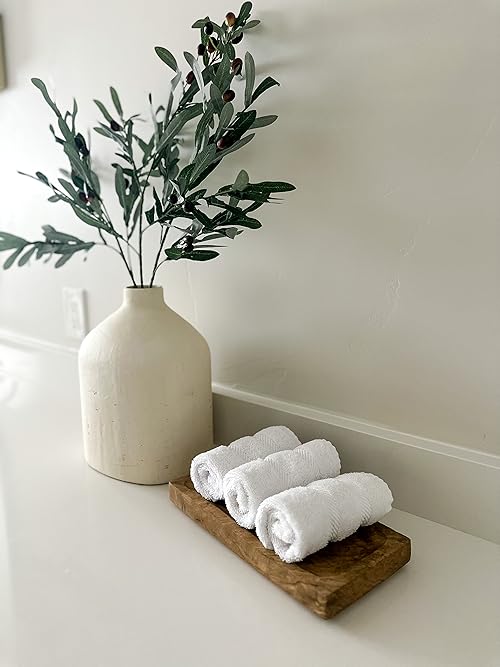
The image size is (500, 667). Find the location of `counter top`. counter top is located at coordinates (138, 608).